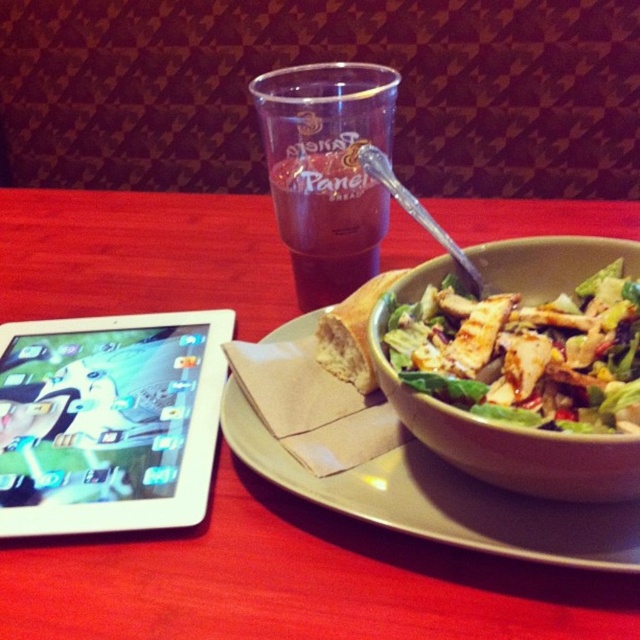
You are standing 10 inches away from the dining table. There is a point at coordinates point (371, 515). Can you reach that point without moving closer to the table?

The distance of point (371, 515) from viewer is 11.14 inches. Since you are currently 10 inches away from the table, you cannot reach the point without moving closer as it is 1.14 inches further away.

You are setting up a dining table and need to place a decorative centerpiece. The current setup has a matte ceramic plate at center. Where should you place the centerpiece to ensure it doesn not obstruct the tablet or the salad bowl?

The matte ceramic plate at center is already positioned at the center, so placing the centerpiece there would likely obstruct both the tablet on the left and the salad bowl on the right. Consider placing the centerpiece slightly to one side or behind the existing items to avoid blocking them.